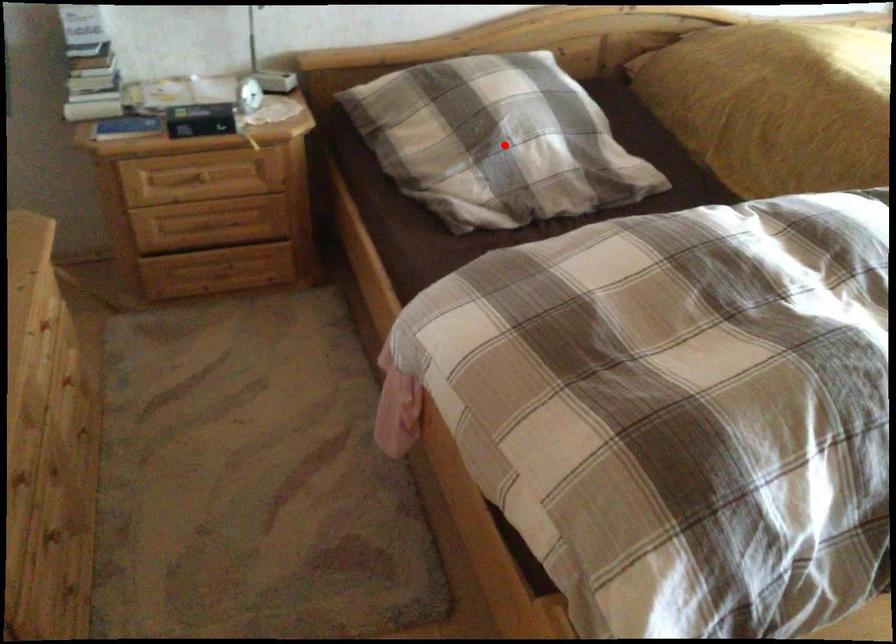
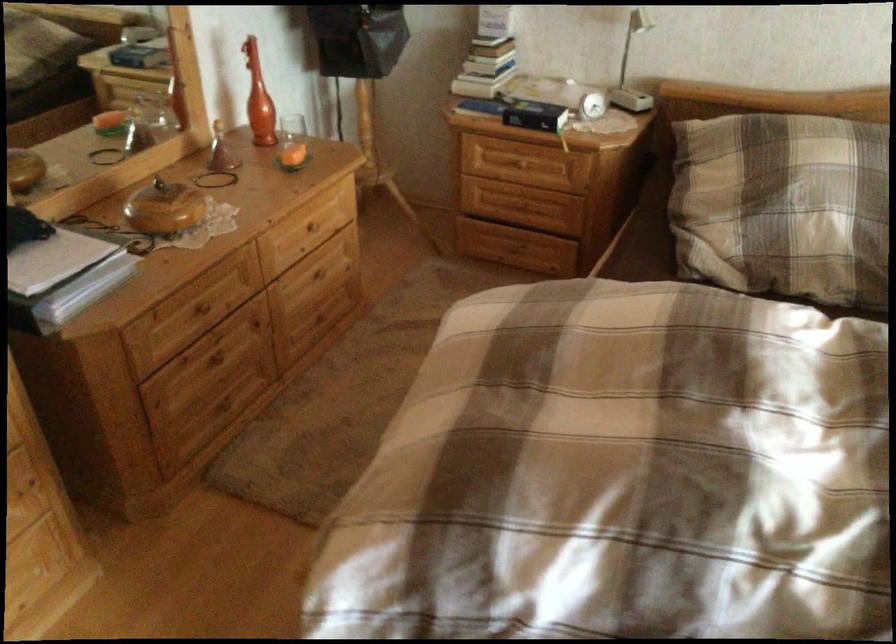
Question: I am providing you with two images of the same scene from different viewpoints. A red point is marked on the first image. At the location where the point appears in image 1, is it still visible in image 2?

Choices:
 (A) Yes
 (B) No

Answer: (A)